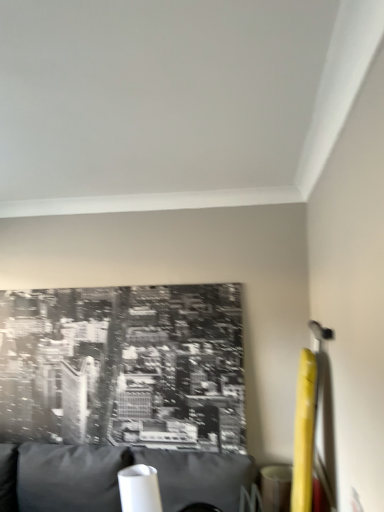
Question: Considering the relative sizes of white glossy table lamp at lower center and matte gray couch at lower left in the image provided, is white glossy table lamp at lower center bigger than matte gray couch at lower left?

Choices:
 (A) yes
 (B) no

Answer: (B)

Question: Is matte gray couch at lower left completely or partially inside white glossy table lamp at lower center?

Choices:
 (A) no
 (B) yes

Answer: (A)

Question: Is white glossy table lamp at lower center thinner than matte gray couch at lower left?

Choices:
 (A) yes
 (B) no

Answer: (A)

Question: Does white glossy table lamp at lower center have a greater width compared to matte gray couch at lower left?

Choices:
 (A) no
 (B) yes

Answer: (A)

Question: Is white glossy table lamp at lower center next to matte gray couch at lower left?

Choices:
 (A) no
 (B) yes

Answer: (A)

Question: Does white glossy table lamp at lower center come behind matte gray couch at lower left?

Choices:
 (A) no
 (B) yes

Answer: (B)

Question: Is matte gray couch at lower left to the right of white glossy table lamp at lower center from the viewer's perspective?

Choices:
 (A) yes
 (B) no

Answer: (B)

Question: Would you say white glossy table lamp at lower center is part of matte gray couch at lower left's contents?

Choices:
 (A) yes
 (B) no

Answer: (A)

Question: Is matte gray couch at lower left positioned with its back to white glossy table lamp at lower center?

Choices:
 (A) yes
 (B) no

Answer: (B)

Question: Can you confirm if matte gray couch at lower left is bigger than white glossy table lamp at lower center?

Choices:
 (A) no
 (B) yes

Answer: (B)

Question: Is matte gray couch at lower left further to the viewer compared to white glossy table lamp at lower center?

Choices:
 (A) yes
 (B) no

Answer: (B)

Question: From the image's perspective, is matte gray couch at lower left beneath white glossy table lamp at lower center?

Choices:
 (A) no
 (B) yes

Answer: (B)

Question: Is white glossy table lamp at lower center bigger or smaller than matte gray couch at lower left?

Choices:
 (A) small
 (B) big

Answer: (A)